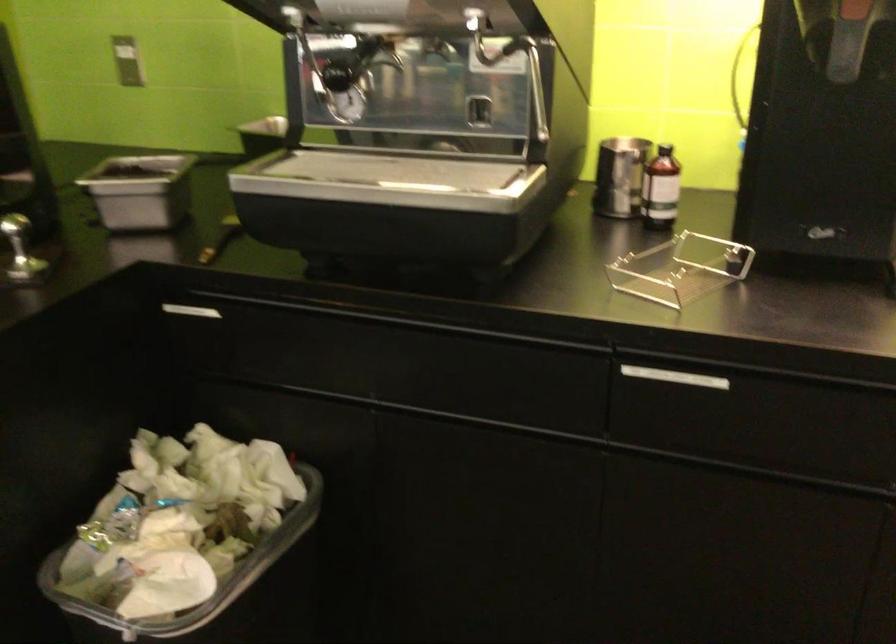
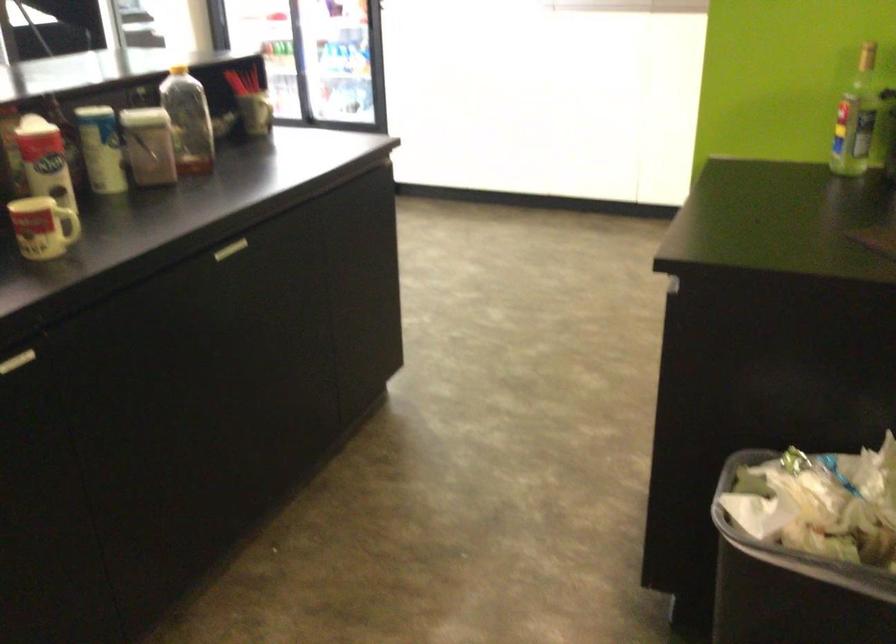
Looking at this image, how did the camera likely rotate?

The camera rotated toward left-down.